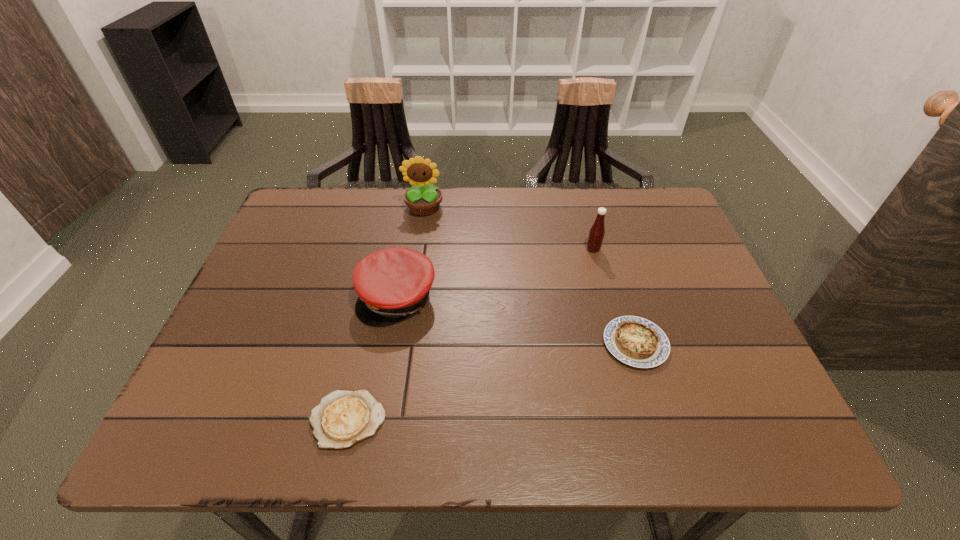
Identify the location of vacant area between the Tabasco sauce and the third shortest object. (495, 273).

This screenshot has width=960, height=540. Identify the location of unoccupied area between the right quiche and the left quiche. (492, 381).

Where is `free space between the nearest object and the farther quiche`? The image size is (960, 540). free space between the nearest object and the farther quiche is located at coordinates (492, 381).

This screenshot has height=540, width=960. I want to click on free space between the third tallest object and the second shortest object, so click(x=516, y=321).

The height and width of the screenshot is (540, 960). In order to click on object that is the second nearest to the nearer quiche in this screenshot , I will do `click(635, 341)`.

Locate an element on the screen. This screenshot has height=540, width=960. object that is the fourth closest to the fourth tallest object is located at coordinates (423, 199).

What are the coordinates of `free space that satisfies the following two spatial constraints: 1. on the face of the fourth nearest object; 2. on the left side of the sunflower` in the screenshot? It's located at (418, 249).

The width and height of the screenshot is (960, 540). Identify the location of vacant point that satisfies the following two spatial constraints: 1. on the face of the farthest object; 2. on the left side of the fourth tallest object. (403, 343).

Where is `free space in the image that satisfies the following two spatial constraints: 1. on the back side of the left quiche; 2. on the right side of the taller quiche`? free space in the image that satisfies the following two spatial constraints: 1. on the back side of the left quiche; 2. on the right side of the taller quiche is located at coordinates (365, 343).

At what (x,y) coordinates should I click in order to perform the action: click on vacant point that satisfies the following two spatial constraints: 1. on the face of the sunflower; 2. on the right side of the second shortest object. Please return your answer as a coordinate pair (x, y). Looking at the image, I should click on (403, 343).